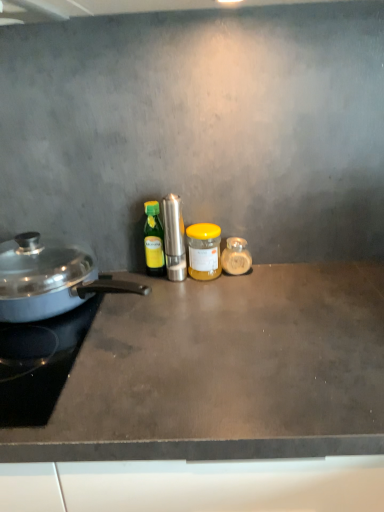
This screenshot has width=384, height=512. Find the location of `free space above dark gray concrete countertop at center (from a real-world perspective)`. free space above dark gray concrete countertop at center (from a real-world perspective) is located at coordinates (211, 336).